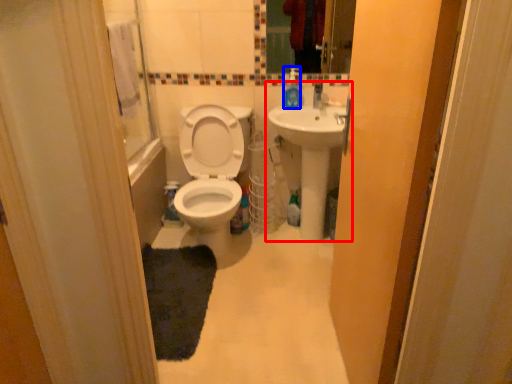
Question: Which point is closer to the camera, sink (highlighted by a red box) or soap dispenser (highlighted by a blue box)?

Choices:
 (A) sink
 (B) soap dispenser

Answer: (A)